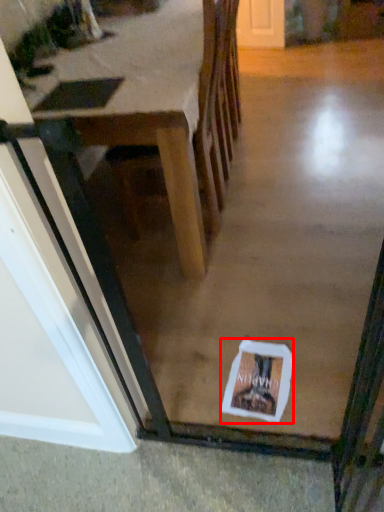
Question: From the image's perspective, what is the correct spatial relationship of postcard (annotated by the red box) in relation to table?

Choices:
 (A) above
 (B) below

Answer: (B)